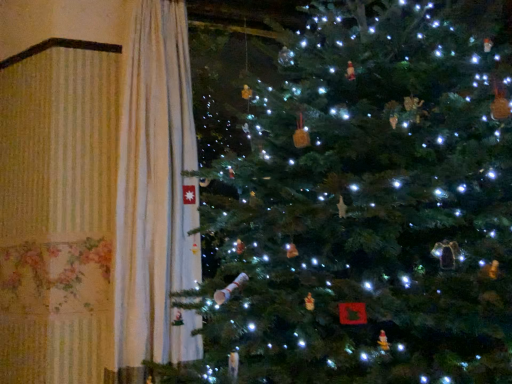
Locate an element on the screen. The image size is (512, 384). white textured curtain at left is located at coordinates (156, 195).

This screenshot has height=384, width=512. Describe the element at coordinates (156, 195) in the screenshot. I see `white textured curtain at left` at that location.

Locate an element on the screen. This screenshot has width=512, height=384. white textured curtain at left is located at coordinates (156, 195).